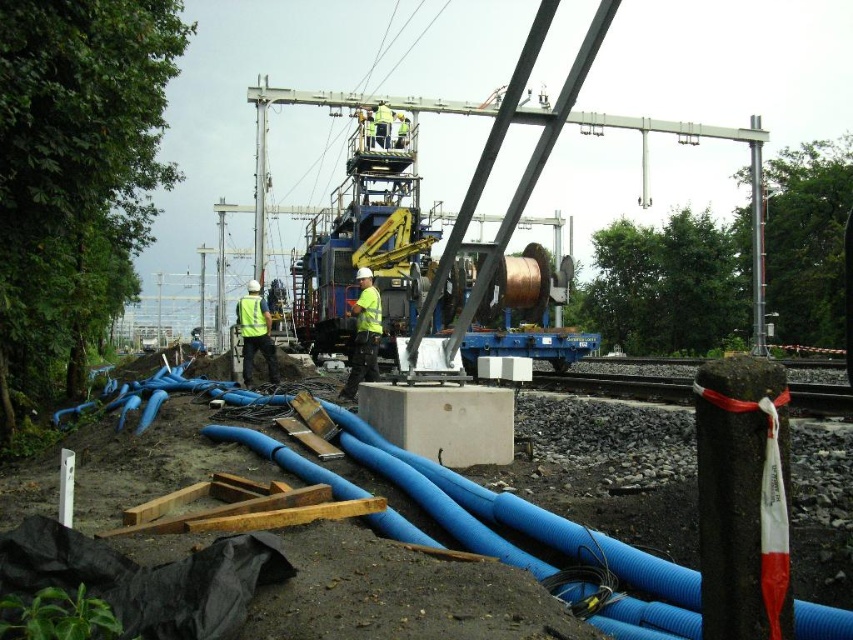
Question: Which point appears farthest from the camera in this image?

Choices:
 (A) (381, 522)
 (B) (265, 332)

Answer: (B)

Question: Which point appears closest to the camera in this image?

Choices:
 (A) coord(241,308)
 (B) coord(433,611)
 (C) coord(374,291)

Answer: (B)

Question: Is blue rubber pipes at lower left further to camera compared to brushed metal pole at center?

Choices:
 (A) yes
 (B) no

Answer: (B)

Question: Is yellow reflective vest at center above reflective yellow vest at center?

Choices:
 (A) yes
 (B) no

Answer: (B)

Question: Which point is farther from the camera taking this photo?

Choices:
 (A) (643, 602)
 (B) (260, 276)

Answer: (B)

Question: Can you confirm if reflective yellow vest at center is smaller than yellow reflective safety vest at center?

Choices:
 (A) no
 (B) yes

Answer: (A)